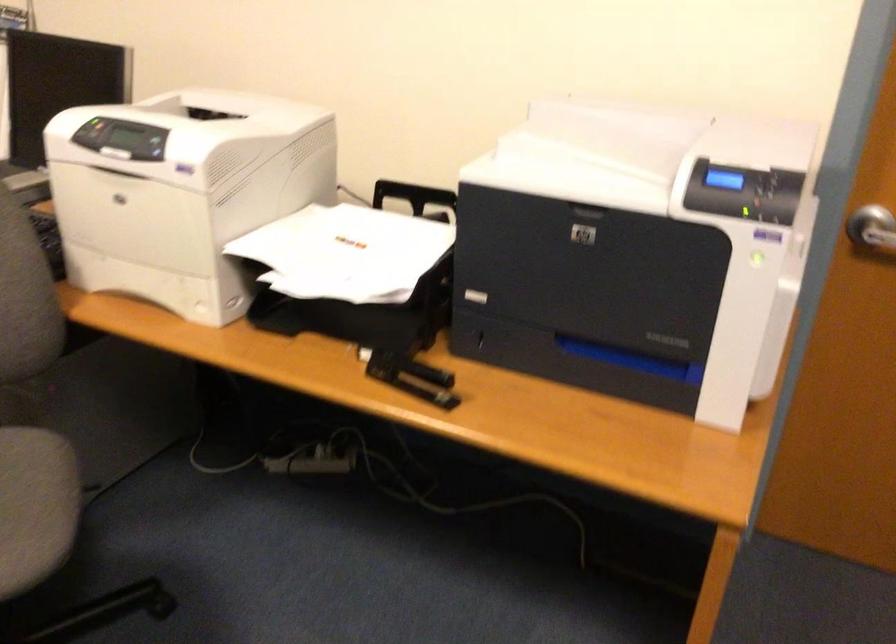
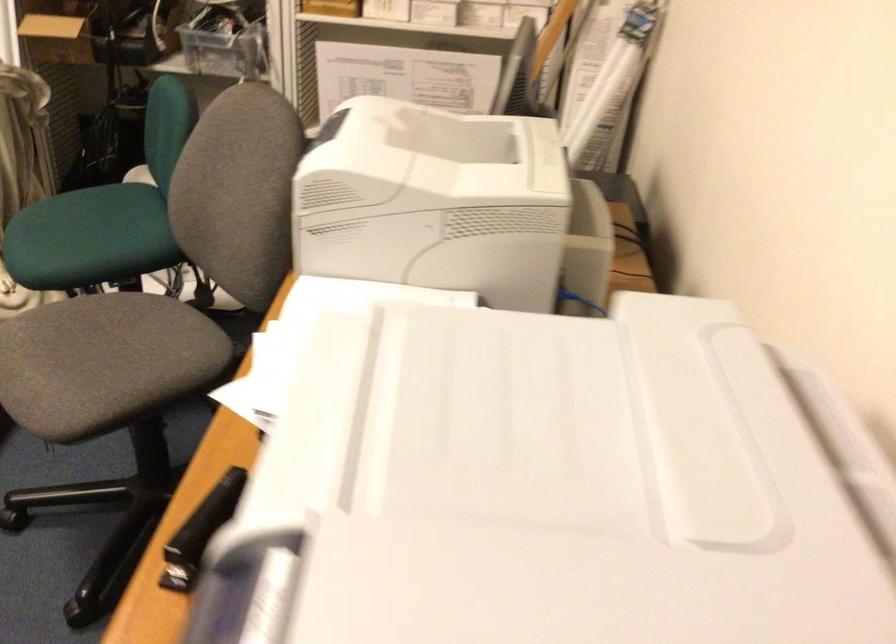
Find the pixel in the second image that matches point (659, 145) in the first image.

(593, 491)